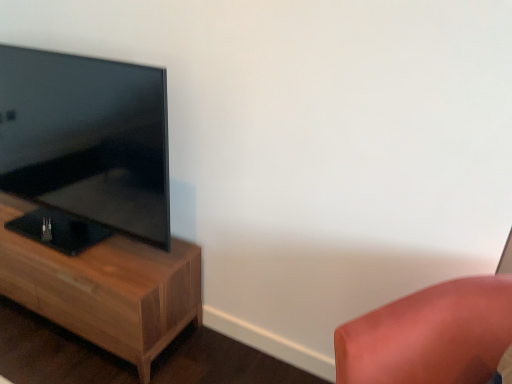
Question: Looking at their shapes, would you say matte black tv at left is wider or thinner than satin pink cushion at lower right?

Choices:
 (A) wide
 (B) thin

Answer: (B)

Question: From their relative heights in the image, would you say matte black tv at left is taller or shorter than satin pink cushion at lower right?

Choices:
 (A) tall
 (B) short

Answer: (A)

Question: Considering the real-world distances, which object is closest to the satin pink cushion at lower right?

Choices:
 (A) wooden nightstand at left
 (B) matte black tv at left

Answer: (A)

Question: Based on their relative distances, which object is nearer to the satin pink cushion at lower right?

Choices:
 (A) matte black tv at left
 (B) wooden nightstand at left

Answer: (B)